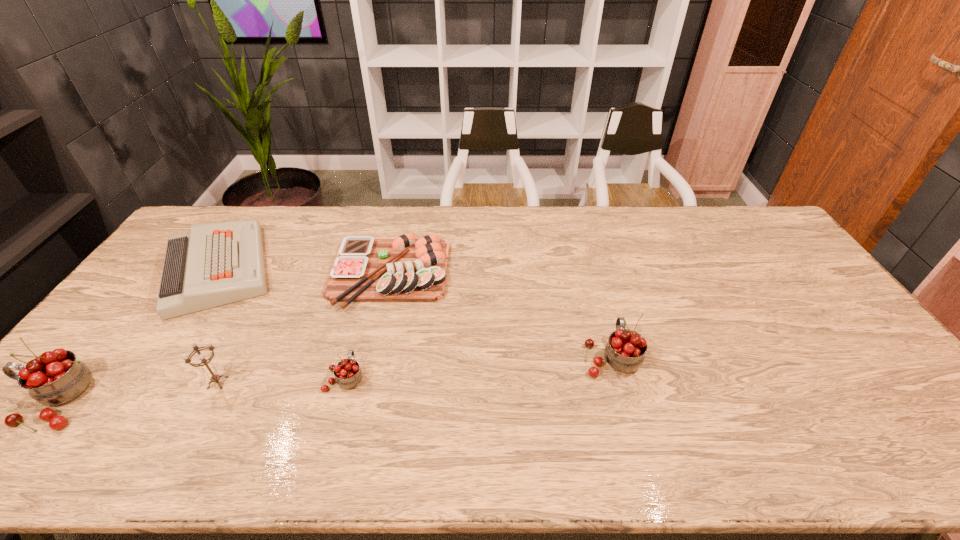
You are a GUI agent. You are given a task and a screenshot of the screen. Output one action in this format:
    pyautogui.click(x=<x>, y=<y>)
    Task: Click on the object present at the left edge
    The width and height of the screenshot is (960, 540).
    Given the screenshot: What is the action you would take?
    pyautogui.click(x=214, y=264)

The image size is (960, 540). I want to click on object situated at the far left corner, so click(214, 264).

Locate an element on the screen. vacant space at the far edge of the desktop is located at coordinates (451, 217).

Locate an element on the screen. The image size is (960, 540). vacant area at the near edge is located at coordinates (352, 397).

Locate an element on the screen. This screenshot has height=540, width=960. vacant region at the right edge of the desktop is located at coordinates (778, 248).

The image size is (960, 540). Find the location of `vacant space at the far right corner`. vacant space at the far right corner is located at coordinates (759, 221).

I want to click on vacant region at the near right corner of the desktop, so click(x=856, y=406).

Find the location of a particular element. Image resolution: width=960 pixels, height=540 pixels. free space that is in between the fourth tallest object and the rightmost object is located at coordinates (478, 367).

Locate an element on the screen. This screenshot has height=540, width=960. vacant area that lies between the shortest cherry and the rightmost object is located at coordinates (478, 367).

This screenshot has width=960, height=540. Find the location of `blank region between the computer keyboard and the platter`. blank region between the computer keyboard and the platter is located at coordinates (304, 271).